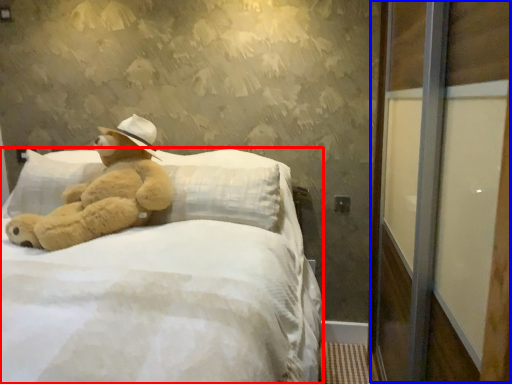
Question: Which of the following is the farthest to the observer, bed (highlighted by a red box) or screen door (highlighted by a blue box)?

Choices:
 (A) bed
 (B) screen door

Answer: (A)